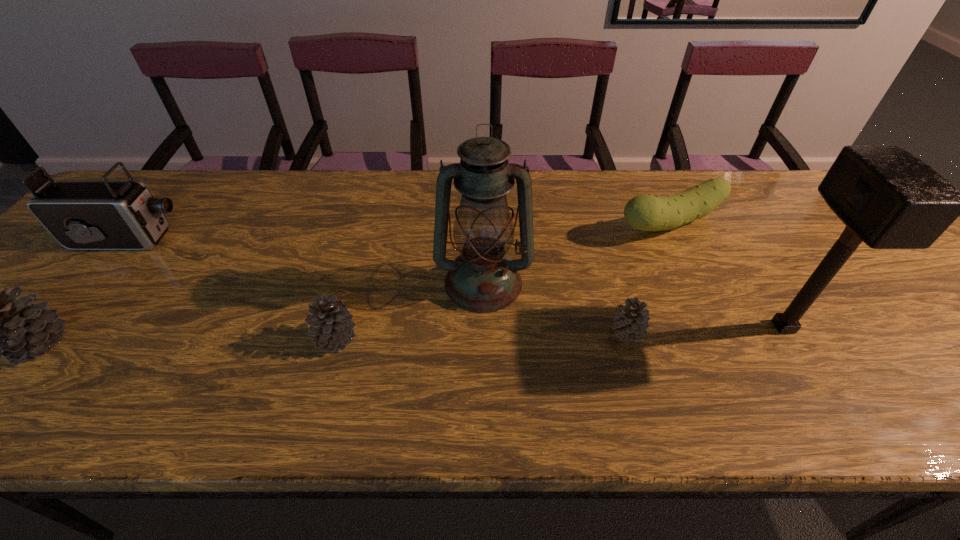
Identify the location of free location located 0.220m at the lens of the camcorder. (265, 240).

Identify the location of free space located 0.330m on the left of the cucumber. (492, 225).

Find the location of a particular element. Image resolution: width=960 pixels, height=540 pixels. vacant space located on the back of the fourth object from right to left is located at coordinates (483, 192).

The image size is (960, 540). In order to click on vacant space located on the back of the mallet in this screenshot , I will do `click(724, 226)`.

Image resolution: width=960 pixels, height=540 pixels. I want to click on object that is at the far edge, so click(x=648, y=212).

Locate an element on the screen. The image size is (960, 540). mallet positioned at the near edge is located at coordinates (888, 198).

Locate an element on the screen. The image size is (960, 540). object at the left edge is located at coordinates (104, 214).

This screenshot has height=540, width=960. What are the coordinates of `vacant space at the far edge` in the screenshot? It's located at (573, 177).

In the image, there is a desktop. In order to click on vacant area at the left edge in this screenshot , I will do `click(99, 282)`.

This screenshot has width=960, height=540. I want to click on vacant space at the far left corner, so click(153, 196).